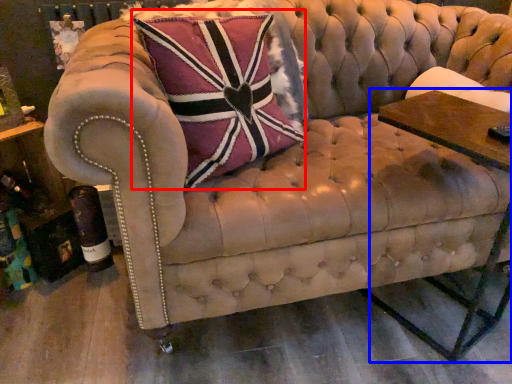
Question: Which object appears closest to the camera in this image, throw pillow (highlighted by a red box) or side table (highlighted by a blue box)?

Choices:
 (A) throw pillow
 (B) side table

Answer: (B)